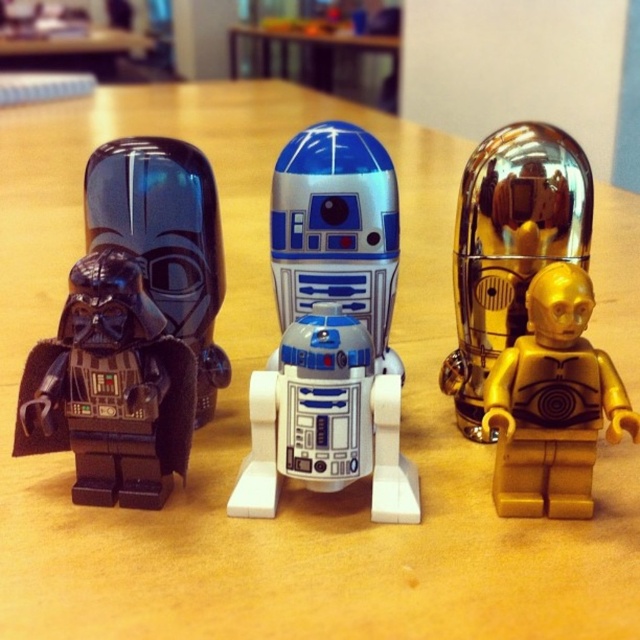
You are a photographer wanting to capture a closeup of the white plastic robot at center without the gold metallic figure at right appearing in the background. Based on their positions, is this possible?

The white plastic robot at center is further to the viewer than the gold metallic figure at right, so yes, you can take a closeup of the white plastic robot at center while keeping the gold metallic figure at right out of focus in the background.

You are trying to place a small LEGO piece on the wooden table at center. The matte black helmet at left is in the way. Can you move the helmet to make space?

The matte black helmet at left is larger than the wooden table at center, so moving it might be necessary to create space for placing the LEGO piece.